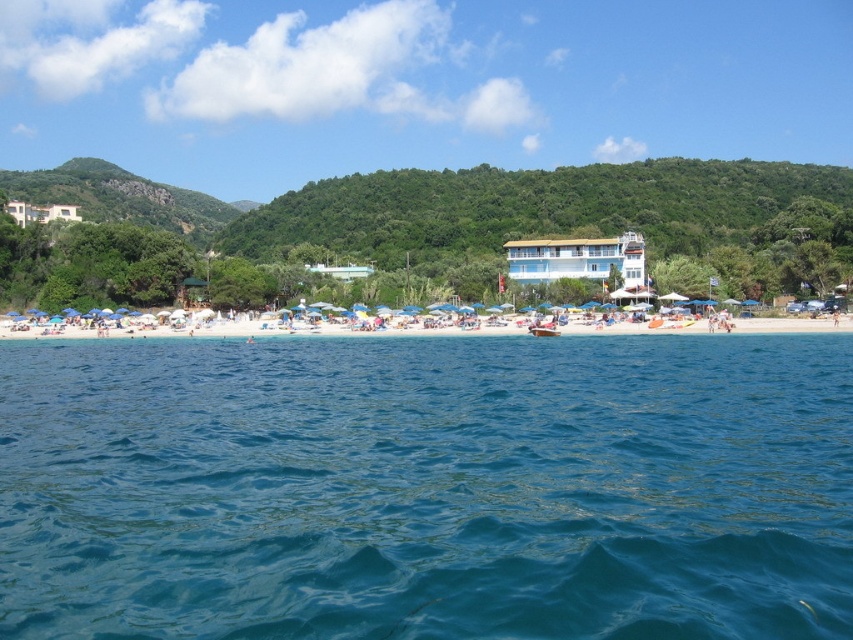
You are standing on the white sand beach at center and want to look at the top of the white glossy building at center. Can you see the top of the building from your current position?

The white sand beach at center has a lesser height compared to white glossy building at center, so yes, you can see the top of the white glossy building at center from your current position on the white sand beach at center.

You are a lifeguard standing on the white glossy building at upper left, and you need to reach the white sand beach at center to assist someone in distress. Given that your average walking speed is 1.5 meters per second, how many seconds will it take you to reach the beach?

The distance between the white glossy building at upper left and the white sand beach at center is 71.13 meters. At a speed of 1.5 meters per second, the time required is 71.13 divided by 1.5, which equals approximately 47.42 seconds. Therefore, it will take roughly 47 seconds to reach the beach.

You are standing at the point labeled point (x=44, y=221) and want to walk to the point labeled point (x=543, y=332). Which direction should you move to get closer to your destination?

To move from point (x=44, y=221) to point (x=543, y=332), you should move northeast because point (x=44, y=221) is behind point (x=543, y=332).